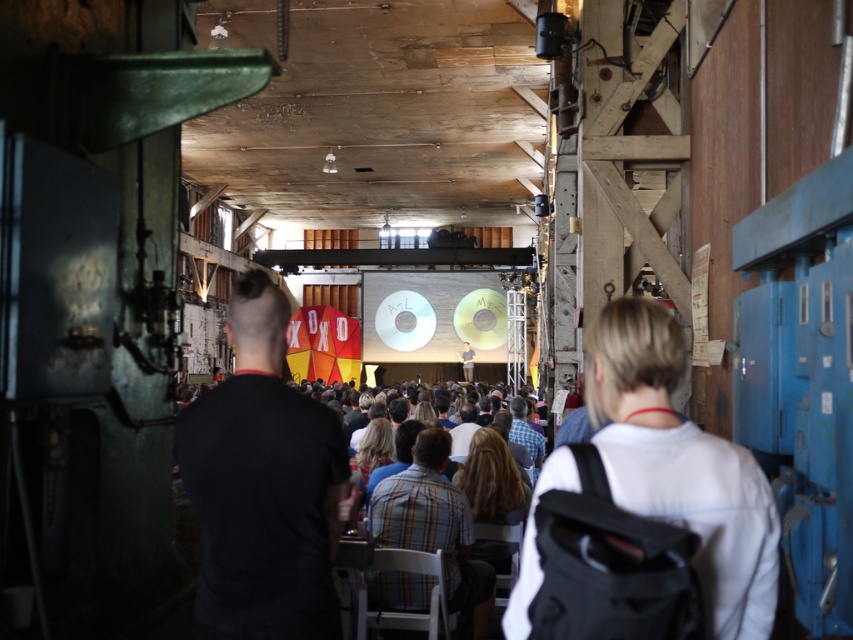
Question: Is black shirt at center positioned in front of white fabric shirt at center?

Choices:
 (A) yes
 (B) no

Answer: (B)

Question: Among these objects, which one is nearest to the camera?

Choices:
 (A) white fabric shirt at center
 (B) black shirt at center

Answer: (A)

Question: Among these points, which one is nearest to the camera?

Choices:
 (A) (289, 554)
 (B) (670, 371)

Answer: (B)

Question: Does black shirt at center appear on the left side of white fabric shirt at center?

Choices:
 (A) yes
 (B) no

Answer: (A)

Question: Where is black shirt at center located in relation to white fabric shirt at center in the image?

Choices:
 (A) above
 (B) below

Answer: (B)